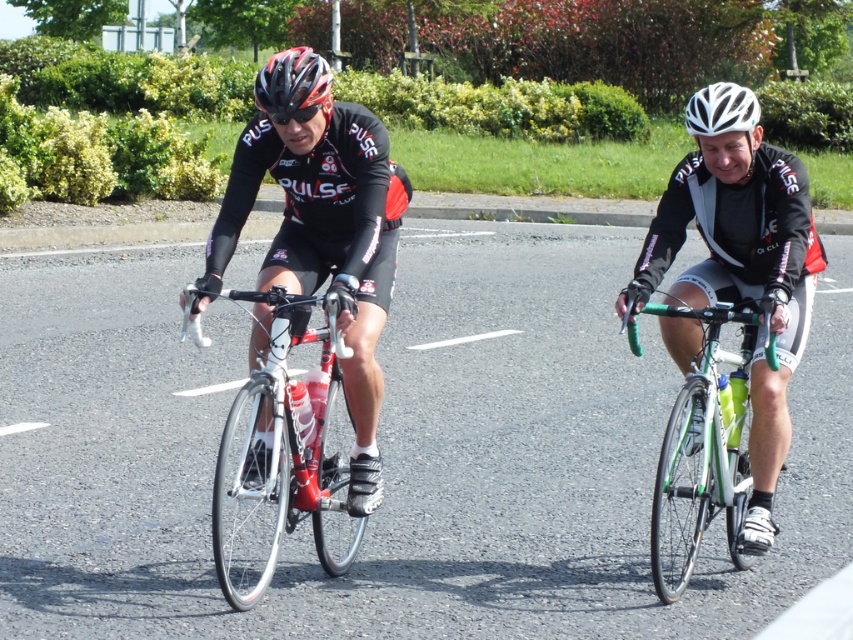
Question: Does shiny metallic bicycle at center have a larger size compared to matte black helmet at center?

Choices:
 (A) yes
 (B) no

Answer: (B)

Question: Which is nearer to the shiny metallic bicycle at center?

Choices:
 (A) green metallic bicycle at right
 (B) white matte bicycle helmet at upper center
 (C) matte black helmet at center

Answer: (A)

Question: Is green metallic bicycle at right closer to the viewer compared to white matte bicycle helmet at upper center?

Choices:
 (A) yes
 (B) no

Answer: (A)

Question: Among these points, which one is nearest to the camera?

Choices:
 (A) (299, 84)
 (B) (311, 518)
 (C) (741, 515)
 (D) (747, 116)

Answer: (A)

Question: From the image, what is the correct spatial relationship of green metallic bicycle at right in relation to white matte bicycle helmet at upper center?

Choices:
 (A) below
 (B) above

Answer: (A)

Question: Which is farther from the matte black helmet at center?

Choices:
 (A) white matte bicycle helmet at upper center
 (B) green metallic bicycle at right

Answer: (A)